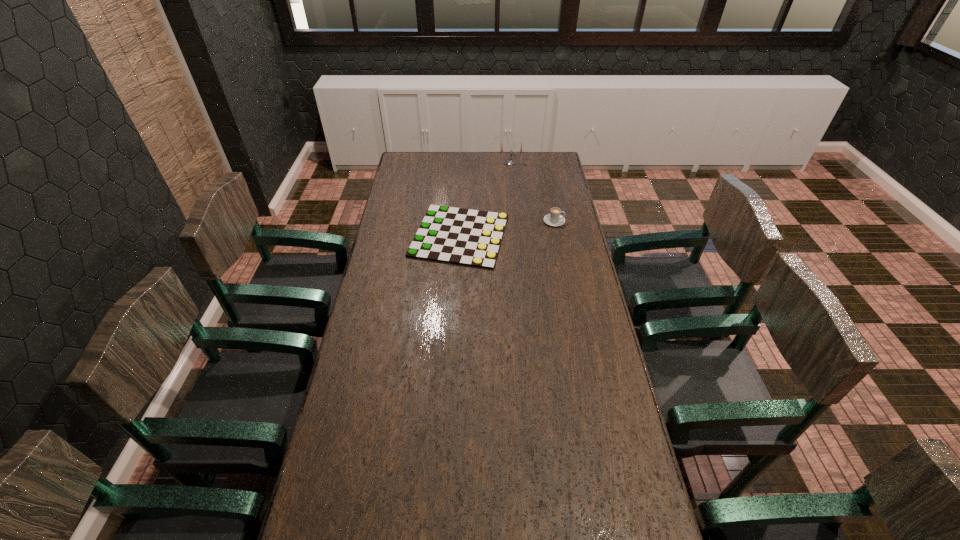
Locate an element on the screen. The width and height of the screenshot is (960, 540). candle is located at coordinates (510, 162).

Identify the location of the tallest object. (510, 162).

Identify the location of the second tallest object. The width and height of the screenshot is (960, 540). click(554, 218).

This screenshot has width=960, height=540. Find the location of `the rightmost object`. the rightmost object is located at coordinates (554, 218).

Locate an element on the screen. the shortest object is located at coordinates (467, 237).

You are a GUI agent. You are given a task and a screenshot of the screen. Output one action in this format:
    pyautogui.click(x=<x>, y=<y>)
    Task: Click on the vacant space situated 0.120m on the front-facing side of the tallest object
    The image size is (960, 540).
    Given the screenshot: What is the action you would take?
    pyautogui.click(x=513, y=177)

At what (x,y) coordinates should I click in order to perform the action: click on free space located 0.310m on the back of the shortest object. Please return your answer as a coordinate pair (x, y). Image resolution: width=960 pixels, height=540 pixels. Looking at the image, I should click on (463, 172).

Find the location of `object that is at the far edge`. object that is at the far edge is located at coordinates (510, 162).

Image resolution: width=960 pixels, height=540 pixels. What are the coordinates of `object situated at the left edge` in the screenshot? It's located at (467, 237).

I want to click on object at the right edge, so click(554, 218).